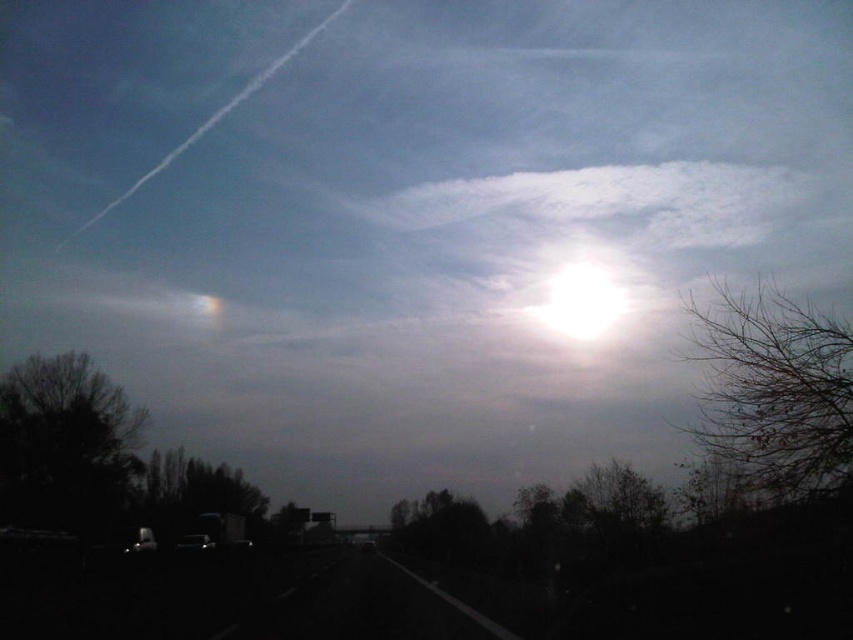
You are a passenger in the car and looking out the window. You see the white fluffy cloud at upper center and the dark green leafy tree at left. Which one appears taller from your perspective?

The white fluffy cloud at upper center appears much taller than the dark green leafy tree at left from your perspective.

You are a passenger in the car and looking out the window. You see the bare branches at right and the white fluffy cloud at upper center. Which object is closer to you?

The bare branches at right is closer to the viewer than the white fluffy cloud at upper center.

You are a passenger in the car and looking out the window. You see the white fluffy cloud at upper center and the bright white cloud at upper center. Which cloud appears closer to you?

The white fluffy cloud at upper center appears closer to you because it is further to the viewer than the bright white cloud at upper center.